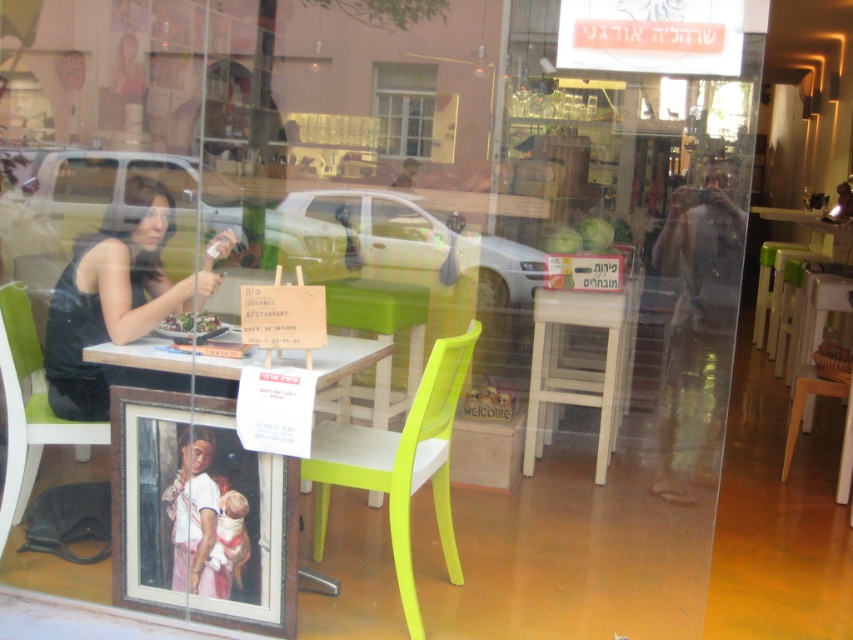
You are a delivery person trying to enter the restaurant. You see the transparent glass door at center and the black matte dress at left. Which object should you approach to enter the restaurant?

You should approach the transparent glass door at center to enter the restaurant since it is positioned to the right of the black matte dress at left, indicating it is the entrance.

You are standing outside the restaurant and want to enter through the transparent glass door at center. The maximum distance you can approach is 6 meters. Can you safely approach the door within the allowed distance?

The transparent glass door at center is 6.46 meters away from camera. Since the maximum allowed distance to approach is 6 meters, you cannot safely approach within the allowed distance as the door is farther than the limit.

You are a customer entering the Bio Organic Restaurant and see the black matte dress at left and the metallic silver phone at right through the reflective window. Which object is closer to the entrance?

The black matte dress at left is closer to the entrance because it is positioned to the left of the metallic silver phone at right, which is further away from the entrance.